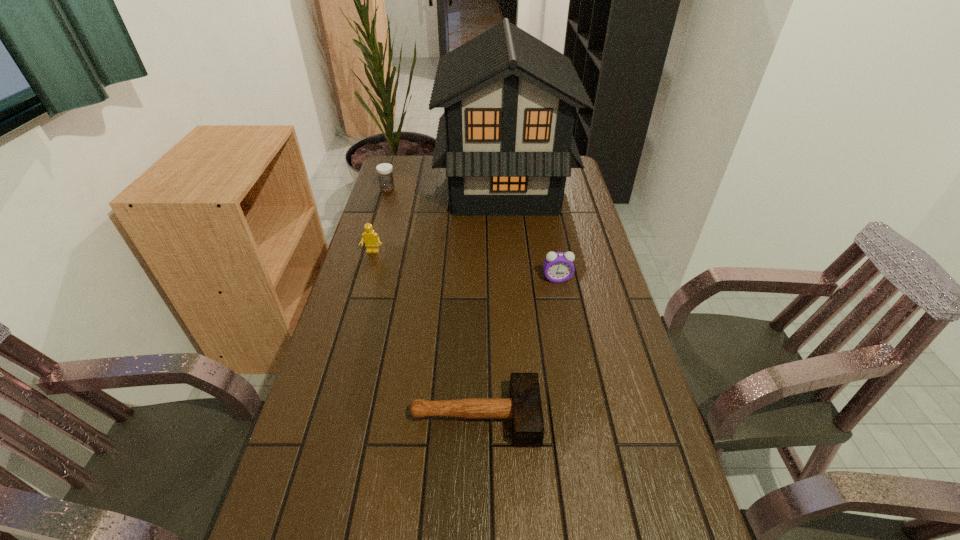
The image size is (960, 540). Find the location of `the tallest object`. the tallest object is located at coordinates (506, 140).

Where is `the third nearest object`? This screenshot has height=540, width=960. the third nearest object is located at coordinates (370, 238).

The width and height of the screenshot is (960, 540). In order to click on alarm clock in this screenshot , I will do `click(558, 266)`.

Where is `medicine`? Image resolution: width=960 pixels, height=540 pixels. medicine is located at coordinates point(384,170).

Locate an element on the screen. the nearest object is located at coordinates (524, 408).

This screenshot has width=960, height=540. Identify the location of mallet. (524, 408).

Where is `free space located on the front-facing side of the tallest object`? The width and height of the screenshot is (960, 540). free space located on the front-facing side of the tallest object is located at coordinates (420, 187).

Identify the location of free location located 0.110m on the front-facing side of the tallest object. The image size is (960, 540). (411, 187).

Locate an element on the screen. This screenshot has height=540, width=960. vacant area located on the front-facing side of the tallest object is located at coordinates (393, 187).

I want to click on vacant space located 0.300m on the face of the Lego, so click(x=351, y=325).